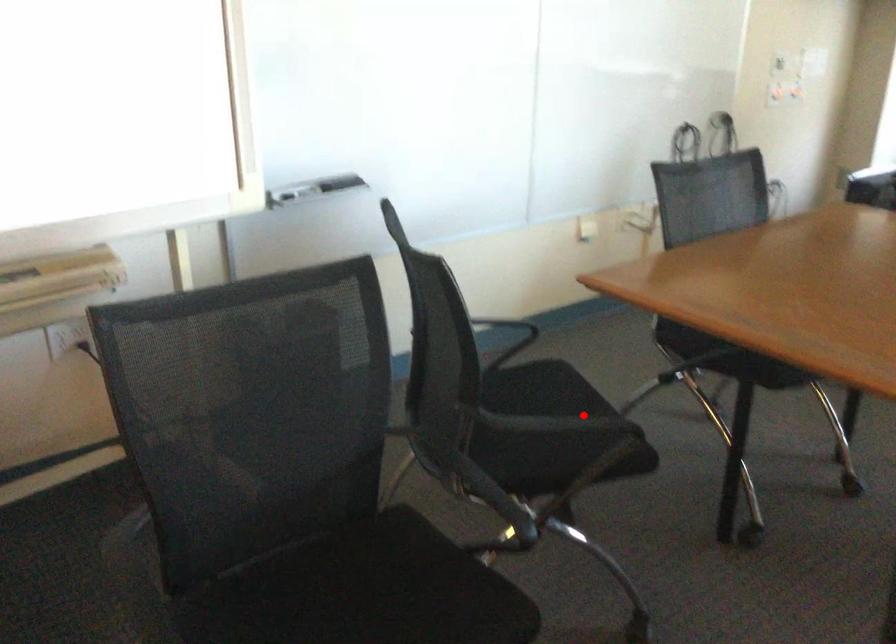
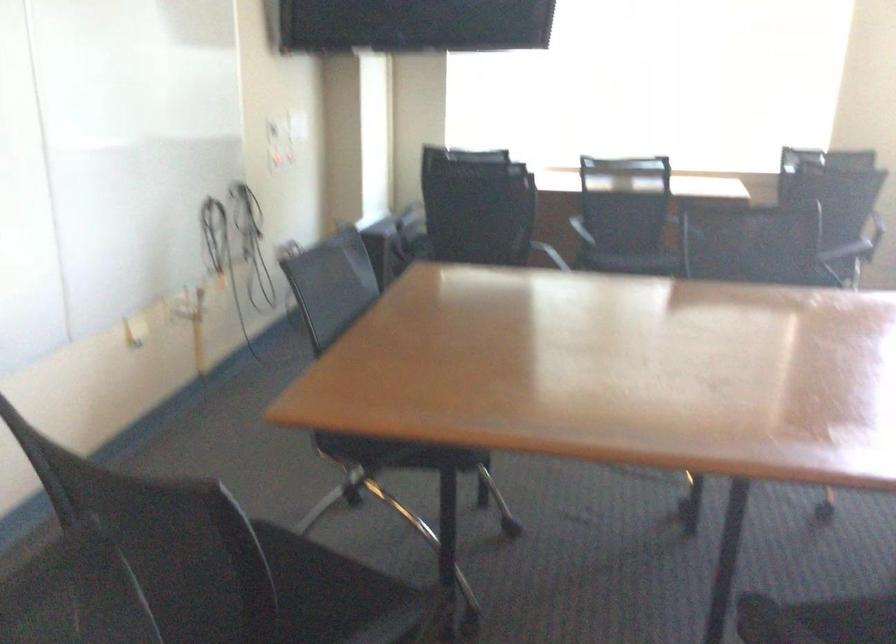
Find the pixel in the second image that matches the highlighted location in the first image.

(331, 592)